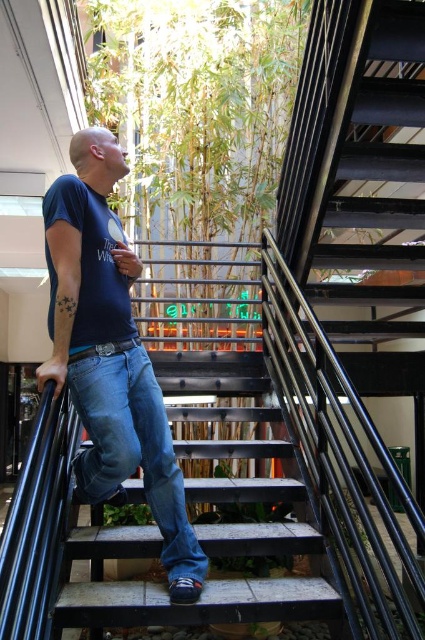
You are standing at the base of the staircase in the image. There is a point marked at coordinates point (193, 532). Can you reach that point without moving from your current position?

The point (193, 532) is 6.55 feet away from the viewer. Since you are at the base of the staircase and the point is 6.55 feet away, you cannot reach it without moving from your current position.

You are a photographer standing in front of the staircase. You want to take a closeup shot of the blue denim jeans at center. Considering the camera you have can focus on objects within 1.5 meters, will you be able to take the photo without moving closer?

The blue denim jeans at center is 1.68 meters away from the camera, which is beyond the camera focus range of 1.5 meters. Therefore, you cannot take the closeup shot without moving closer.